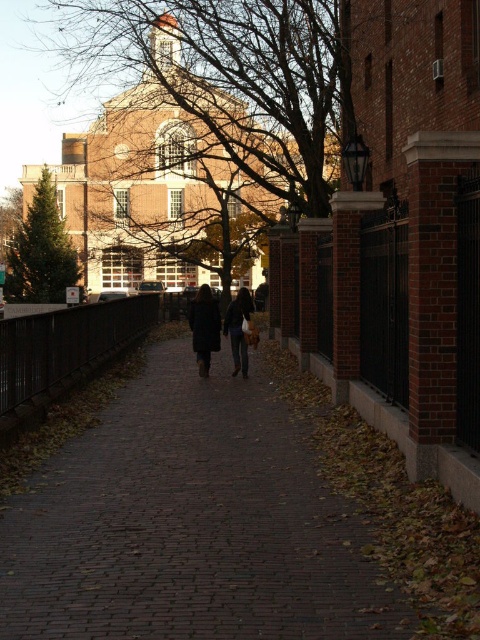
Question: Does green matte tree at left have a greater width compared to dark wool coat at center?

Choices:
 (A) yes
 (B) no

Answer: (A)

Question: Is brick pavement at center to the right of green matte tree at left from the viewer's perspective?

Choices:
 (A) yes
 (B) no

Answer: (A)

Question: Which object is positioned farthest from the dark brown leather coat at center?

Choices:
 (A) dark wool coat at center
 (B) dark brown leather jacket at center
 (C) green matte tree at left

Answer: (C)

Question: Which point is closer to the camera?

Choices:
 (A) dark brown leather coat at center
 (B) dark brown leather jacket at center
 (C) dark wool coat at center

Answer: (B)

Question: Estimate the real-world distances between objects in this image. Which object is farther from the dark wool coat at center?

Choices:
 (A) dark brown leather jacket at center
 (B) green matte tree at left
 (C) brick pavement at center
 (D) dark brown leather coat at center

Answer: (B)

Question: Observing the image, what is the correct spatial positioning of green matte tree at left in reference to dark brown leather jacket at center?

Choices:
 (A) above
 (B) below

Answer: (A)